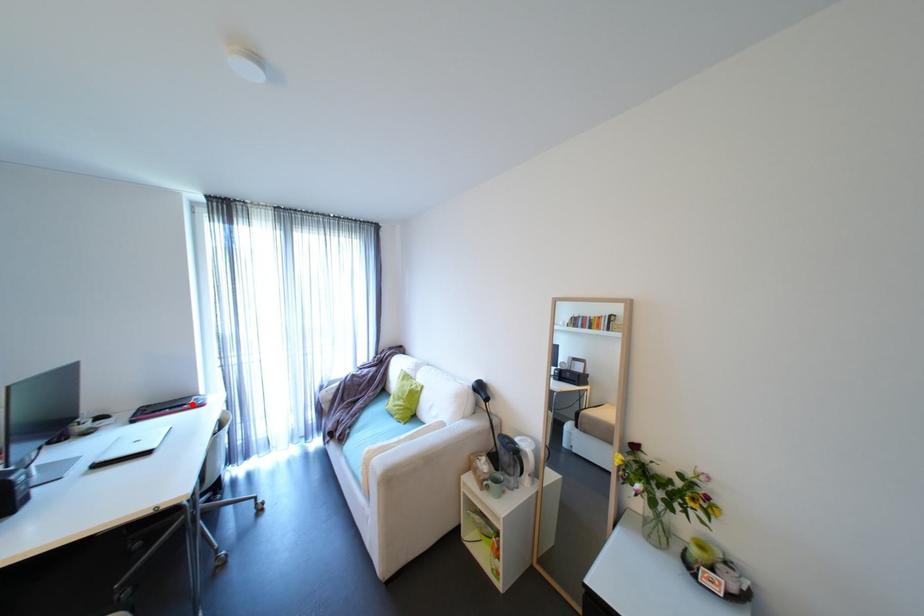
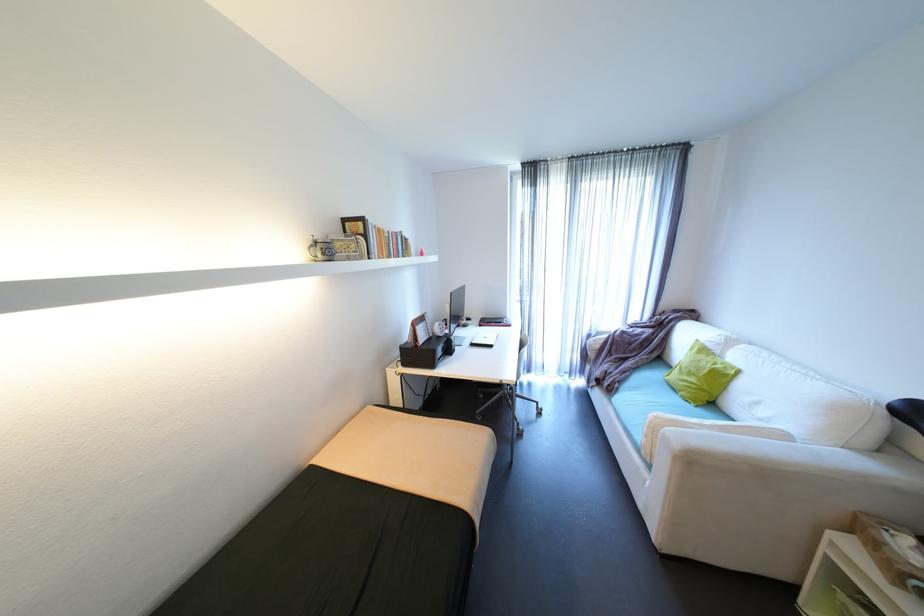
The point at the highlighted location is marked in the first image. Where is the corresponding point in the second image?

(508, 323)